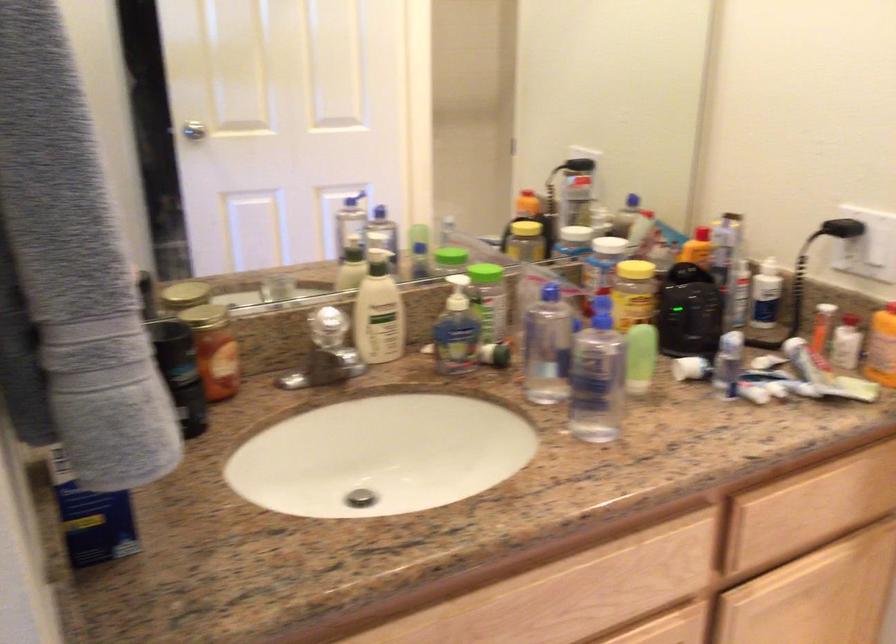
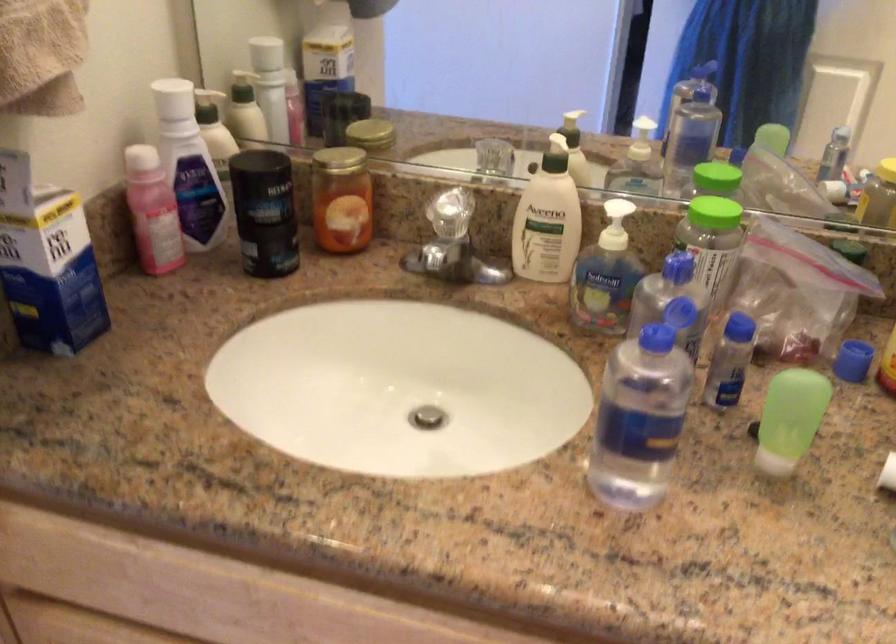
In the scene shown: The images are taken continuously from a first-person perspective. In which direction is your viewpoint rotating?

The rotation direction of the camera is left-down.